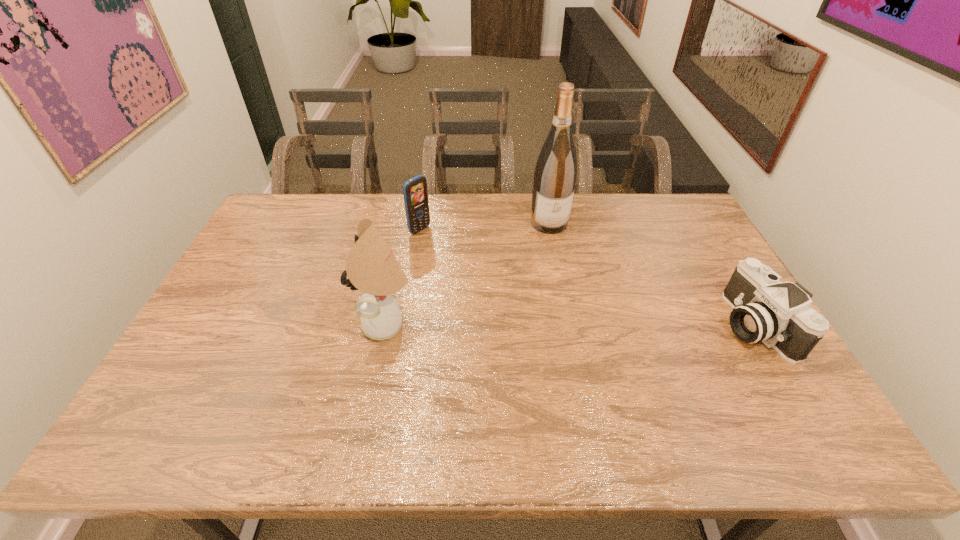
The height and width of the screenshot is (540, 960). In order to click on vacant region located 0.400m on the screen of the third tallest object in this screenshot , I will do `click(514, 292)`.

At what (x,y) coordinates should I click in order to perform the action: click on free space located on the screen of the third tallest object. Please return your answer as a coordinate pair (x, y). Looking at the image, I should click on (440, 244).

This screenshot has height=540, width=960. Identify the location of vacant position located on the screen of the third tallest object. (452, 252).

Where is `vacant region located on the label of the second object from right to left`? vacant region located on the label of the second object from right to left is located at coordinates (558, 246).

Locate an element on the screen. free location located on the label of the second object from right to left is located at coordinates (576, 297).

You are a GUI agent. You are given a task and a screenshot of the screen. Output one action in this format:
    pyautogui.click(x=<x>, y=<y>)
    Task: Click on the blank area located on the label of the second object from right to left
    The image size is (960, 540).
    Given the screenshot: What is the action you would take?
    pyautogui.click(x=572, y=287)

At what (x,y) coordinates should I click in order to perform the action: click on cellular telephone that is at the far edge. Please return your answer as a coordinate pair (x, y). The width and height of the screenshot is (960, 540). Looking at the image, I should click on (415, 193).

Identify the location of wine bottle located at the far edge. This screenshot has height=540, width=960. (555, 175).

Locate an element on the screen. This screenshot has width=960, height=540. object located at the right edge is located at coordinates (779, 314).

You are a GUI agent. You are given a task and a screenshot of the screen. Output one action in this format:
    pyautogui.click(x=<x>, y=<y>)
    Task: Click on the vacant area at the far edge
    
    Given the screenshot: What is the action you would take?
    pyautogui.click(x=382, y=230)